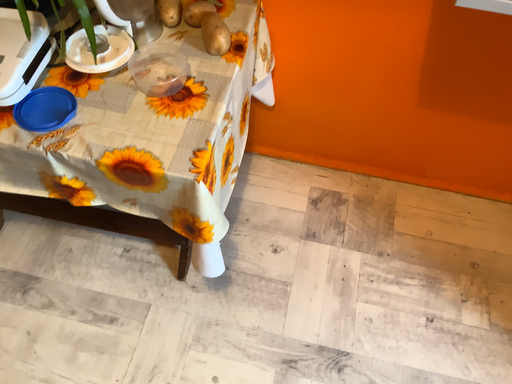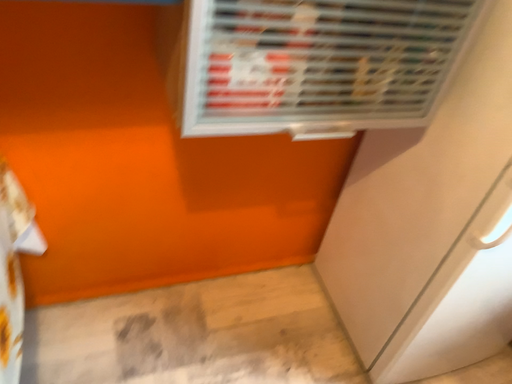
Question: Which way did the camera rotate in the video?

Choices:
 (A) rotated right
 (B) rotated left

Answer: (A)